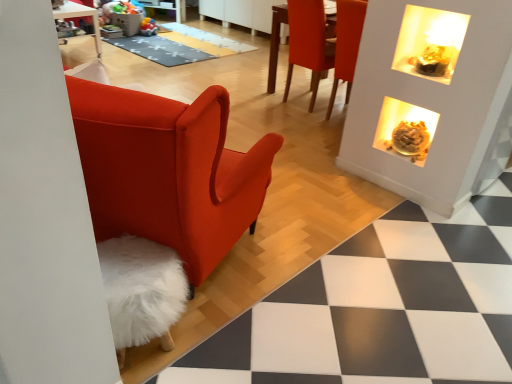
This screenshot has width=512, height=384. I want to click on vacant area situated to the left side of matte orange chair at upper right, so click(x=258, y=97).